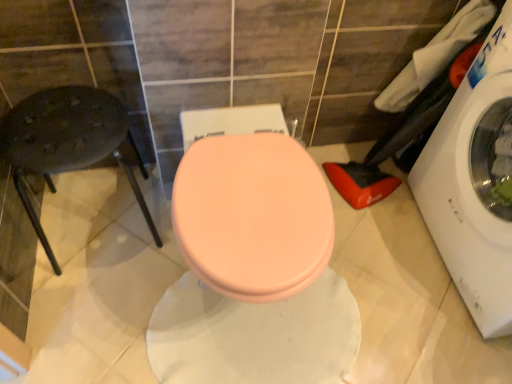
What are the coordinates of `vacant space in front of metallic black stool at left` in the screenshot? It's located at (86, 320).